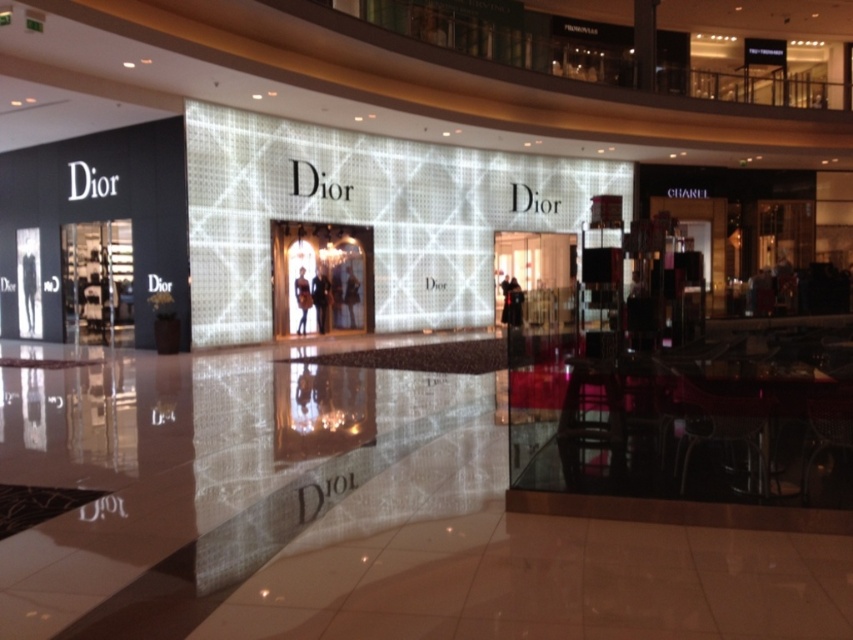
From the picture: You are a customer standing outside the Dior store entrance. You notice two items displayed through the glass window at the center of the store. Which item is closer to the floor, the dark fabric coat at center or the matte black dress at center?

The dark fabric coat at center is positioned under the matte black dress at center, so the dark fabric coat at center is closer to the floor.

You are a customer looking at the Dior store entrance. You see a dark fabric coat at center and a matte black dress at center. Which one is more to the right?

The dark fabric coat at center is more to the right side of the matte black dress at center.

You are a fashion designer visiting the Dior store. You want to place a new accessory between the dark fabric coat at center and the matte black dress at center. The accessory requires a minimum of 18 inches of space. Can the accessory fit between them?

The distance between the dark fabric coat at center and the matte black dress at center is 17.66 inches, which is less than the required 18 inches. Therefore, the accessory cannot fit between them.